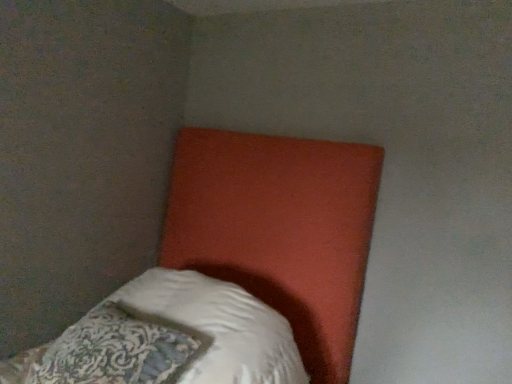
Question: Is white soft pillow at lower left placed right next to matte orange headboard at upper center?

Choices:
 (A) yes
 (B) no

Answer: (B)

Question: Is white soft pillow at lower left looking in the opposite direction of matte orange headboard at upper center?

Choices:
 (A) yes
 (B) no

Answer: (A)

Question: Is white soft pillow at lower left positioned behind matte orange headboard at upper center?

Choices:
 (A) yes
 (B) no

Answer: (A)

Question: Is white soft pillow at lower left to the left of matte orange headboard at upper center from the viewer's perspective?

Choices:
 (A) no
 (B) yes

Answer: (B)

Question: Does white soft pillow at lower left appear on the right side of matte orange headboard at upper center?

Choices:
 (A) no
 (B) yes

Answer: (A)

Question: Does white soft pillow at lower left have a lesser width compared to matte orange headboard at upper center?

Choices:
 (A) yes
 (B) no

Answer: (A)

Question: From a real-world perspective, is matte orange headboard at upper center positioned under white soft pillow at lower left based on gravity?

Choices:
 (A) no
 (B) yes

Answer: (A)

Question: Is matte orange headboard at upper center smaller than white soft pillow at lower left?

Choices:
 (A) no
 (B) yes

Answer: (A)

Question: Would you say matte orange headboard at upper center is a long distance from white soft pillow at lower left?

Choices:
 (A) yes
 (B) no

Answer: (B)

Question: From the image's perspective, is matte orange headboard at upper center located beneath white soft pillow at lower left?

Choices:
 (A) no
 (B) yes

Answer: (A)

Question: Does matte orange headboard at upper center have a greater width compared to white soft pillow at lower left?

Choices:
 (A) no
 (B) yes

Answer: (B)

Question: Considering the relative positions of matte orange headboard at upper center and white soft pillow at lower left in the image provided, is matte orange headboard at upper center to the right of white soft pillow at lower left from the viewer's perspective?

Choices:
 (A) yes
 (B) no

Answer: (A)

Question: Is white soft pillow at lower left to the left or to the right of matte orange headboard at upper center in the image?

Choices:
 (A) right
 (B) left

Answer: (B)